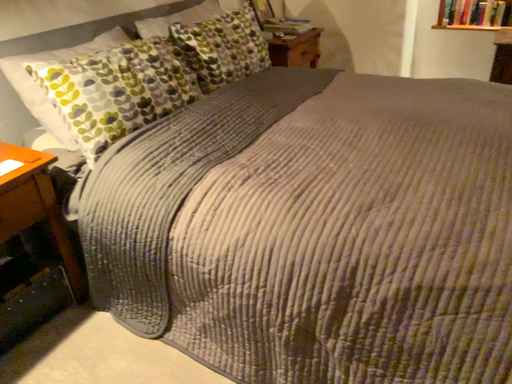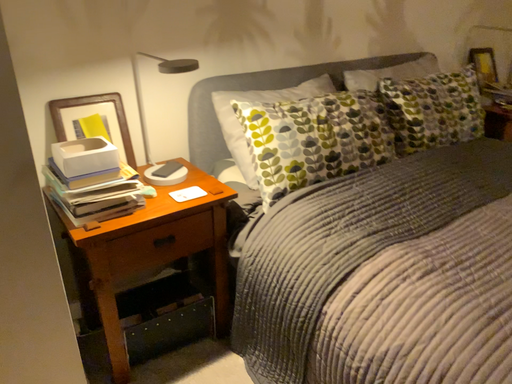
Question: How did the camera likely rotate when shooting the video?

Choices:
 (A) rotated right
 (B) rotated left

Answer: (B)